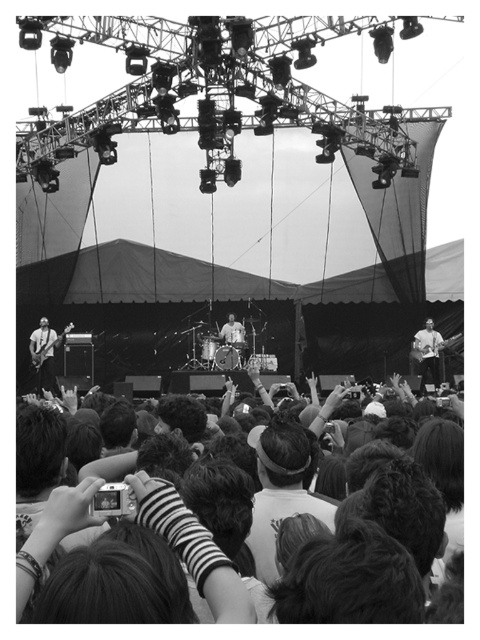
Can you confirm if matte black guitar at left is smaller than smooth white shirt at right?

Actually, matte black guitar at left might be larger than smooth white shirt at right.

What do you see at coordinates (45, 355) in the screenshot?
I see `matte black guitar at left` at bounding box center [45, 355].

Where is `matte black guitar at left`? matte black guitar at left is located at coordinates (45, 355).

Between dark hair at lower center and smooth white shirt at right, which one is positioned higher?

smooth white shirt at right

Can you confirm if dark hair at lower center is positioned below smooth white shirt at right?

Correct, dark hair at lower center is located below smooth white shirt at right.

You are a GUI agent. You are given a task and a screenshot of the screen. Output one action in this format:
    pyautogui.click(x=<x>, y=<y>)
    Task: Click on the dark hair at lower center
    This screenshot has width=480, height=640.
    Given the screenshot: What is the action you would take?
    click(x=54, y=532)

Does dark hair at lower center appear under matte black guitar at left?

Yes.

Does point (228, 614) come farther from viewer compared to point (46, 372)?

No.

Which is in front, point (21, 564) or point (43, 321)?

Point (21, 564) is more forward.

I want to click on dark hair at lower center, so click(x=54, y=532).